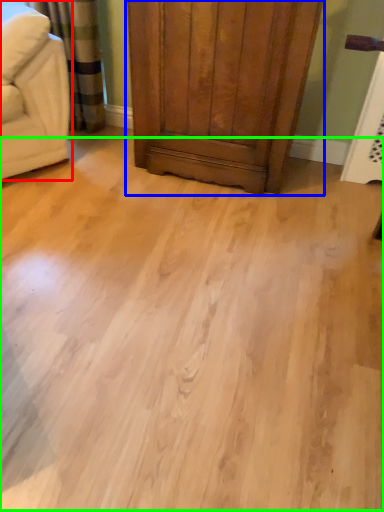
Question: Which object is positioned farthest from furniture (highlighted by a red box)? Select from dresser (highlighted by a blue box) and plain (highlighted by a green box).

Choices:
 (A) dresser
 (B) plain

Answer: (B)